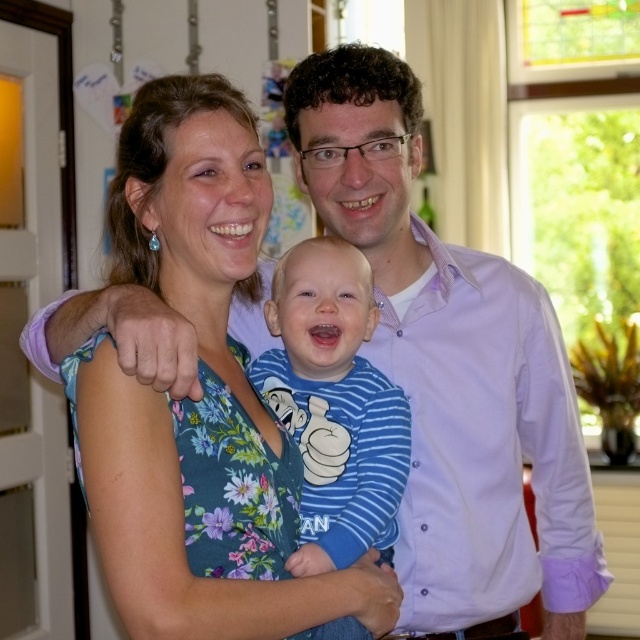
Which is behind, point (129, 484) or point (339, 518)?

Positioned behind is point (339, 518).

Locate an element on the screen. Image resolution: width=640 pixels, height=640 pixels. floral fabric dress at center is located at coordinates (198, 401).

Who is more distant from viewer, (195,566) or (326,316)?

Point (326,316)

Locate an element on the screen. The height and width of the screenshot is (640, 640). floral fabric dress at center is located at coordinates (198, 401).